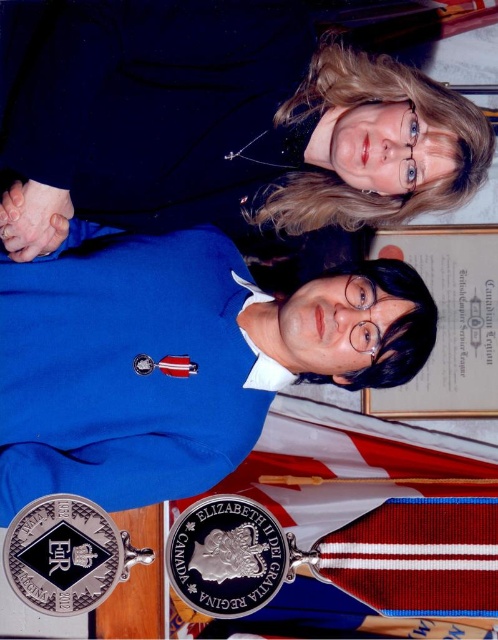
Question: Which of the following is the farthest from the observer?

Choices:
 (A) (276, 554)
 (B) (334, 180)
 (C) (495, 592)

Answer: (B)

Question: Can you confirm if matte black jacket at upper center is positioned to the right of red fabric flag at center?

Choices:
 (A) yes
 (B) no

Answer: (B)

Question: Which object is positioned farthest from the red fabric flag at center?

Choices:
 (A) silver/polished metal badge at center
 (B) matte black jacket at upper center
 (C) black enamel badge at lower left

Answer: (B)

Question: Which point is farther to the camera?

Choices:
 (A) red-white-striped flag at center
 (B) black enamel badge at lower left

Answer: (A)

Question: Is red-white-striped flag at center bigger than red fabric flag at center?

Choices:
 (A) no
 (B) yes

Answer: (B)

Question: In this image, where is black enamel badge at lower left located relative to red fabric flag at lower right?

Choices:
 (A) above
 (B) below

Answer: (A)